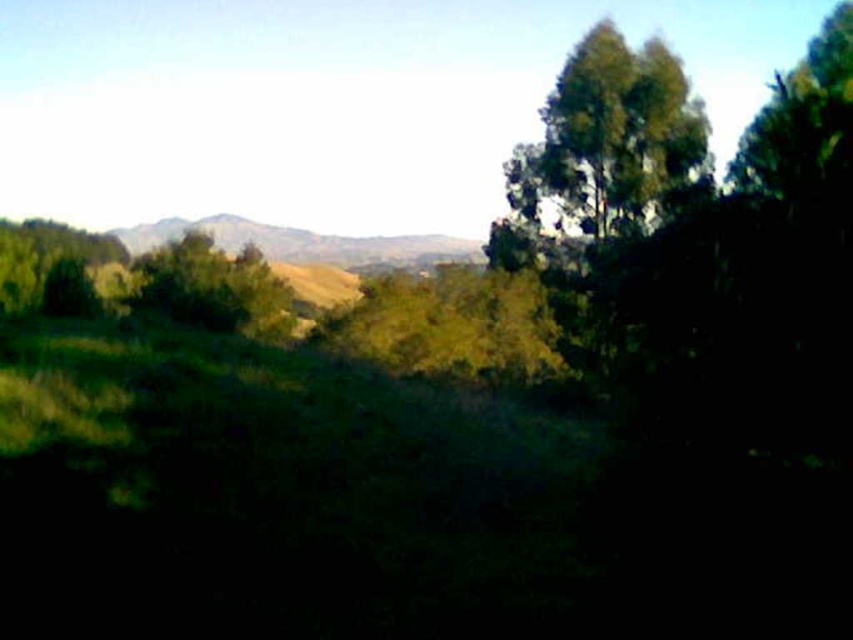
Question: Is green leafy tree at upper right to the left of rugged brown mountain at center from the viewer's perspective?

Choices:
 (A) no
 (B) yes

Answer: (A)

Question: From the image, what is the correct spatial relationship of green leafy tree at upper right in relation to rugged brown mountain at center?

Choices:
 (A) right
 (B) left

Answer: (A)

Question: Which object appears farthest from the camera in this image?

Choices:
 (A) rugged brown mountain at center
 (B) green leafy tree at upper right

Answer: (A)

Question: Which object appears farthest from the camera in this image?

Choices:
 (A) green leafy tree at upper right
 (B) rugged brown mountain at center

Answer: (B)

Question: Which object appears closest to the camera in this image?

Choices:
 (A) rugged brown mountain at center
 (B) green leafy tree at upper right

Answer: (B)

Question: Can you confirm if green leafy tree at upper right is positioned to the right of rugged brown mountain at center?

Choices:
 (A) yes
 (B) no

Answer: (A)